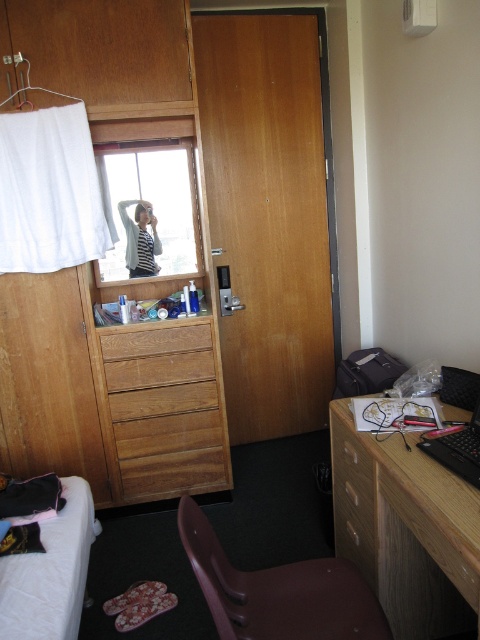
This screenshot has width=480, height=640. I want to click on white quilted bed at lower left, so click(x=49, y=572).

From the picture: Is white quilted bed at lower left positioned in front of striped shirt at upper left?

Yes.

Who is more forward, (x=21, y=566) or (x=146, y=272)?

Positioned in front is point (x=21, y=566).

At what (x,y) coordinates should I click in order to perform the action: click on white quilted bed at lower left. Please return your answer as a coordinate pair (x, y). The image size is (480, 640). Looking at the image, I should click on (49, 572).

Is wooden dresser at center shorter than wooden desk at lower right?

No, wooden dresser at center is not shorter than wooden desk at lower right.

Identify the location of wooden dresser at center. (177, 278).

Is wooden desk at lower right taller than brown plastic chair at lower center?

Yes.

Does wooden desk at lower right appear on the left side of brown plastic chair at lower center?

In fact, wooden desk at lower right is to the right of brown plastic chair at lower center.

Between point (447, 532) and point (292, 582), which one is positioned behind?

The point (292, 582) is behind.

This screenshot has height=640, width=480. In order to click on wooden desk at lower right in this screenshot , I will do `click(406, 529)`.